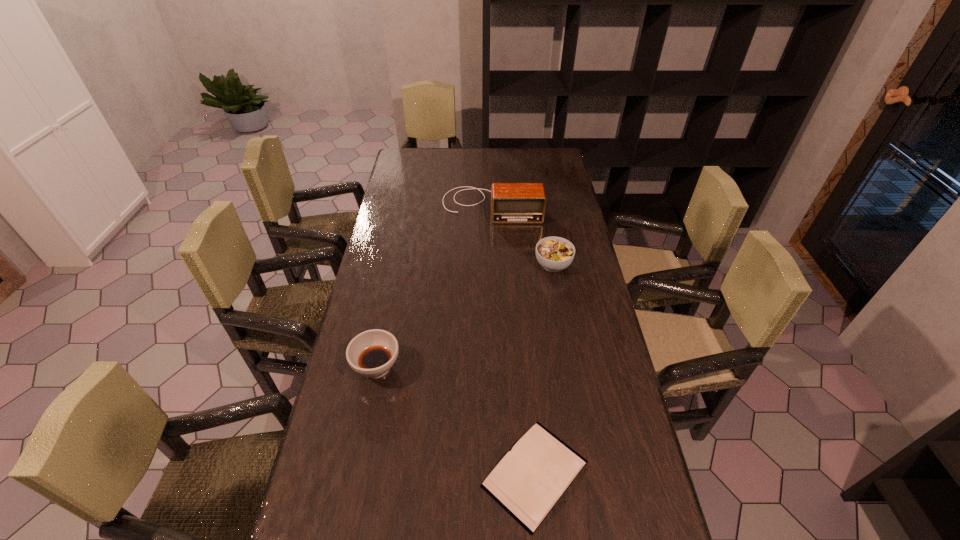
Identify the location of radio receiver. (510, 202).

The image size is (960, 540). I want to click on the tallest object, so click(510, 202).

Locate an element on the screen. The image size is (960, 540). the left soup bowl is located at coordinates (372, 353).

You are a GUI agent. You are given a task and a screenshot of the screen. Output one action in this format:
    pyautogui.click(x=<x>, y=<y>)
    Task: Click on the second nearest object
    
    Given the screenshot: What is the action you would take?
    pyautogui.click(x=372, y=353)

The height and width of the screenshot is (540, 960). In order to click on the farther soup bowl in this screenshot , I will do `click(553, 253)`.

The height and width of the screenshot is (540, 960). In order to click on the third nearest object in this screenshot , I will do `click(553, 253)`.

Locate an element on the screen. the nearest object is located at coordinates (530, 479).

This screenshot has width=960, height=540. In order to click on hardback book in this screenshot , I will do `click(530, 479)`.

Find the location of a particular element. The image size is (960, 540). vacant space located 0.180m on the front-facing side of the radio receiver is located at coordinates (492, 255).

In order to click on vacant space located on the right of the second nearest object in this screenshot , I will do `click(490, 367)`.